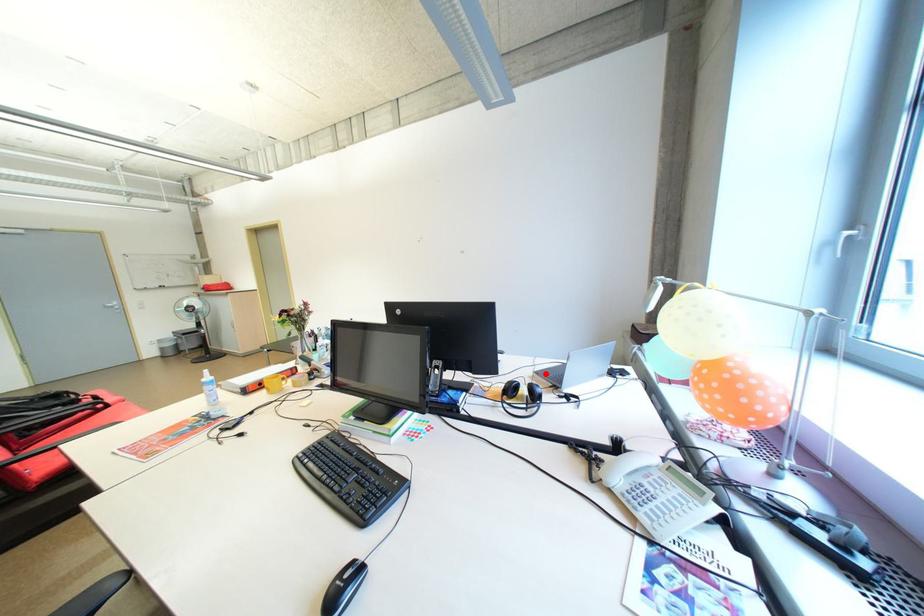
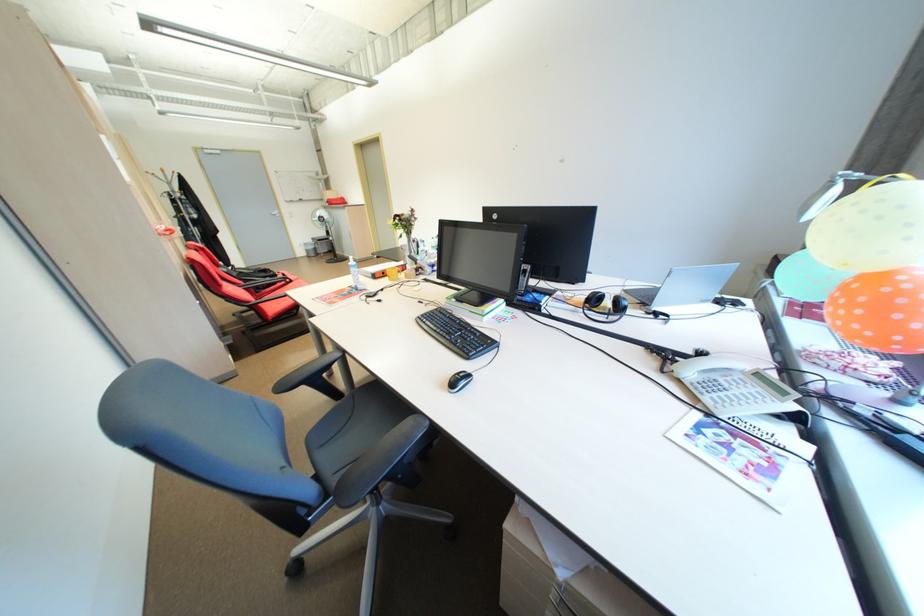
Find the pixel in the second image that matches the highlighted location in the first image.

(635, 292)